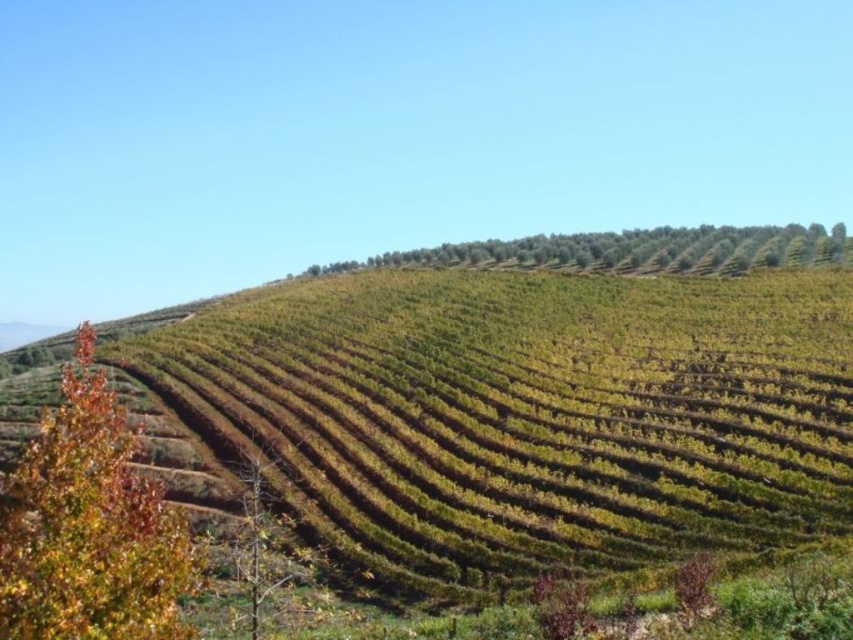
You are standing in the vineyard and want to take a photo of both the green leafy trees at upper center and the brown leafless tree at lower left. Which tree should you position to your left to include both in the frame?

You should position the brown leafless tree at lower left to your left side because the green leafy trees at upper center is on the right side of it, so placing the brown leafless tree at lower left to your left will allow both to be in the frame.

You are a landscape architect planning to install a walking path between the multicolored foliage at left and the green leafy trees at upper center. Given that the path requires a minimum of 80 meters to accommodate a scenic route, will the available space between them suffice?

The distance between the multicolored foliage at left and the green leafy trees at upper center is 85.79 meters, which exceeds the required 80 meters. Therefore, the available space is sufficient to accommodate the scenic walking path.

You are standing in the vineyard and want to take a photo of both the multicolored foliage at left and the green leafy trees at upper center. Which one should you focus on first to ensure both are in clear view?

You should focus on the multicolored foliage at left first since it is closer to the viewer, allowing the green leafy trees at upper center to stay in focus as they are further away.